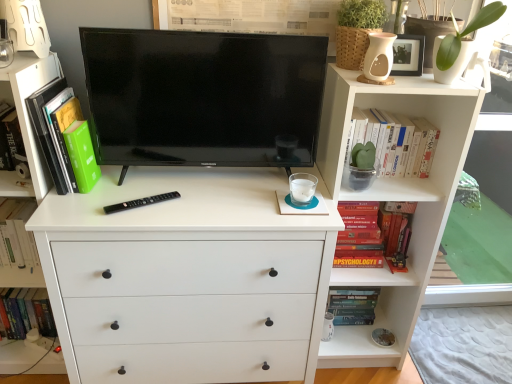
Image resolution: width=512 pixels, height=384 pixels. Find the location of `green matte leaf at upper right`. green matte leaf at upper right is located at coordinates (466, 34).

Where is `hardcover book at center-right, which is the 3th book in left-to-right order`? This screenshot has width=512, height=384. hardcover book at center-right, which is the 3th book in left-to-right order is located at coordinates (353, 305).

This screenshot has height=384, width=512. Find the location of `white matte plain at lower right`. white matte plain at lower right is located at coordinates (463, 345).

Is point (91, 126) closer to viewer compared to point (44, 155)?

That is False.

From a real-world perspective, which object rests below the other?

green matte book at left, the second book viewed from the left, is physically lower.

Does black glossy tv at center have a lesser width compared to green matte book at left, the second book viewed from the left?

Yes, black glossy tv at center is thinner than green matte book at left, the second book viewed from the left.

Considering the relative positions of black glossy tv at center and green matte book at left, the 4th book from the right, in the image provided, is black glossy tv at center in front of green matte book at left, the 4th book from the right,?

No, the depth of black glossy tv at center is greater than that of green matte book at left, the 4th book from the right.

Does green matte book at left, the second book viewed from the left, contain hardcover book at center-right, which is the 3th book in left-to-right order?

No, hardcover book at center-right, which is the 3th book in left-to-right order, is not surrounded by green matte book at left, the second book viewed from the left.

In the scene shown: How much distance is there between green matte book at left, the 4th book from the right, and hardcover book at center-right, the 3th book when ordered from right to left?

green matte book at left, the 4th book from the right, is 1.21 meters from hardcover book at center-right, the 3th book when ordered from right to left.

From the image's perspective, does green matte book at left, the 4th book from the right, appear lower than hardcover book at center-right, the 3th book when ordered from right to left?

No, from the image's perspective, green matte book at left, the 4th book from the right, is not below hardcover book at center-right, the 3th book when ordered from right to left.

In the scene shown: Who is more distant, green matte book at left, the 4th book from the right, or hardcover book at center-right, which is the 3th book in left-to-right order?

hardcover book at center-right, which is the 3th book in left-to-right order, is further away from the camera.

Is green matte book at left, the second book viewed from the left, inside the boundaries of black glossy tv at center, or outside?

green matte book at left, the second book viewed from the left, is located beyond the bounds of black glossy tv at center.

Which point is more forward, (71,121) or (250,57)?

The point (250,57) is more forward.

Could you tell me if green matte book at left, the 4th book from the right, is facing black glossy tv at center?

Yes, green matte book at left, the 4th book from the right, is turned towards black glossy tv at center.

Can you confirm if green matte book at left, the 4th book from the right, is bigger than black glossy tv at center?

Actually, green matte book at left, the 4th book from the right, might be smaller than black glossy tv at center.

The height and width of the screenshot is (384, 512). What are the coordinates of `plain lying behind the white matte chest of drawers at center` in the screenshot? It's located at pos(463,345).

Is white matte plain at lower right completely or partially outside of white matte chest of drawers at center?

Yes, white matte plain at lower right is not within white matte chest of drawers at center.

Based on the photo, from a real-world perspective, who is located lower, white matte plain at lower right or white matte chest of drawers at center?

white matte plain at lower right is physically lower.

Would you say hardcover book at center-right, the 3th book when ordered from right to left, is inside or outside white matte plain at lower right?

hardcover book at center-right, the 3th book when ordered from right to left, lies outside white matte plain at lower right.

In terms of width, does hardcover book at center-right, the 3th book when ordered from right to left, look wider or thinner when compared to white matte plain at lower right?

hardcover book at center-right, the 3th book when ordered from right to left, is thinner than white matte plain at lower right.

Can you confirm if hardcover book at center-right, which is the 3th book in left-to-right order, is positioned to the right of white matte plain at lower right?

No, hardcover book at center-right, which is the 3th book in left-to-right order, is not to the right of white matte plain at lower right.

The width and height of the screenshot is (512, 384). I want to click on plain that is under the hardcover book at center-right, the 3th book when ordered from right to left (from a real-world perspective), so click(463, 345).

From a real-world perspective, is green matte leaf at upper right above or below hardcover psychology book at right, the 2th book from the right?

green matte leaf at upper right is above hardcover psychology book at right, the 2th book from the right.

Does green matte leaf at upper right have a lesser height compared to hardcover psychology book at right, which is the 4th book from left to right?

Yes, green matte leaf at upper right is shorter than hardcover psychology book at right, which is the 4th book from left to right.

Is green matte leaf at upper right to the left or to the right of hardcover psychology book at right, which is the 4th book from left to right, in the image?

Based on their positions, green matte leaf at upper right is located to the right of hardcover psychology book at right, which is the 4th book from left to right.

Is point (466, 32) positioned after point (349, 204)?

No, (466, 32) is closer to viewer.

Is hardcover books at upper right, which is counted as the 5th book, starting from the left, positioned with its back to black glossy tv at center?

No, hardcover books at upper right, which is counted as the 5th book, starting from the left, is not facing the opposite direction of black glossy tv at center.

Does hardcover books at upper right, which is the 1th book from right to left, touch black glossy tv at center?

hardcover books at upper right, which is the 1th book from right to left, is not next to black glossy tv at center, and they're not touching.

Based on the photo, do you think hardcover books at upper right, which is the 1th book from right to left, is within black glossy tv at center, or outside of it?

hardcover books at upper right, which is the 1th book from right to left, cannot be found inside black glossy tv at center.

Which is closer, (362, 139) or (153, 76)?

The point (153, 76) is in front.

Locate an element on the screen. Image resolution: width=512 pixels, height=384 pixels. book that is the 2nd one when counting downward from the black glossy tv at center (from the image's perspective) is located at coordinates (55, 130).

Find the location of a particular element. the 3rd book directly beneath the green matte book at left, the second book viewed from the left (from a real-world perspective) is located at coordinates (353, 305).

Looking at the image, which one is located closer to black glossy tv at center, hardcover book at center-right, which is the 3th book in left-to-right order, or white matte chest of drawers at center?

white matte chest of drawers at center is positioned closer to the anchor black glossy tv at center.

Estimate the real-world distances between objects in this image. Which object is further from hardcover book at center-right, the 3th book when ordered from right to left, black glossy tv at center or hardcover book at left, the first book viewed from the left?

Based on the image, hardcover book at left, the first book viewed from the left, appears to be further to hardcover book at center-right, the 3th book when ordered from right to left.

Which object lies nearer to the anchor point hardcover book at left, which ranks as the fifth book in right-to-left order, hardcover book at center-right, which is the 3th book in left-to-right order, or white matte plain at lower right?

hardcover book at center-right, which is the 3th book in left-to-right order, lies closer to hardcover book at left, which ranks as the fifth book in right-to-left order, than the other object.

Considering their positions, is black glossy tv at center positioned closer to white matte chest of drawers at center than white matte plain at lower right?

Based on the image, black glossy tv at center appears to be nearer to white matte chest of drawers at center.

Looking at the image, which one is located closer to hardcover book at center-right, which is the 3th book in left-to-right order, green matte leaf at upper right or hardcover book at left, the first book viewed from the left?

green matte leaf at upper right lies closer to hardcover book at center-right, which is the 3th book in left-to-right order, than the other object.

Based on their spatial positions, is white matte chest of drawers at center or hardcover psychology book at right, which is the 4th book from left to right, further from hardcover books at upper right, which is counted as the 5th book, starting from the left?

white matte chest of drawers at center is further to hardcover books at upper right, which is counted as the 5th book, starting from the left.

Looking at the image, which one is located closer to hardcover book at center-right, which is the 3th book in left-to-right order, white matte plain at lower right or hardcover books at upper right, which is counted as the 5th book, starting from the left?

white matte plain at lower right lies closer to hardcover book at center-right, which is the 3th book in left-to-right order, than the other object.

From the image, which object appears to be nearer to black glossy tv at center, hardcover psychology book at right, which is the 4th book from left to right, or hardcover book at left, which ranks as the fifth book in right-to-left order?

hardcover psychology book at right, which is the 4th book from left to right.

This screenshot has height=384, width=512. In order to click on the chest of drawers situated between hardcover book at left, which ranks as the fifth book in right-to-left order, and hardcover book at center-right, the 3th book when ordered from right to left, from left to right in this screenshot , I will do `click(187, 277)`.

Identify the location of the chest of drawers situated between hardcover book at left, the first book viewed from the left, and hardcover books at upper right, which is the 1th book from right to left, from left to right. (187, 277).

You are a GUI agent. You are given a task and a screenshot of the screen. Output one action in this format:
    pyautogui.click(x=<x>, y=<y>)
    Task: Click on the chest of drawers located between green matte book at left, the second book viewed from the left, and hardcover psychology book at right, which is the 4th book from left to right, in the left-right direction
    
    Given the screenshot: What is the action you would take?
    pyautogui.click(x=187, y=277)

You are a GUI agent. You are given a task and a screenshot of the screen. Output one action in this format:
    pyautogui.click(x=<x>, y=<y>)
    Task: Click on the television between white matte chest of drawers at center and white matte plain at lower right in the horizontal direction
    The width and height of the screenshot is (512, 384).
    Given the screenshot: What is the action you would take?
    pyautogui.click(x=203, y=97)